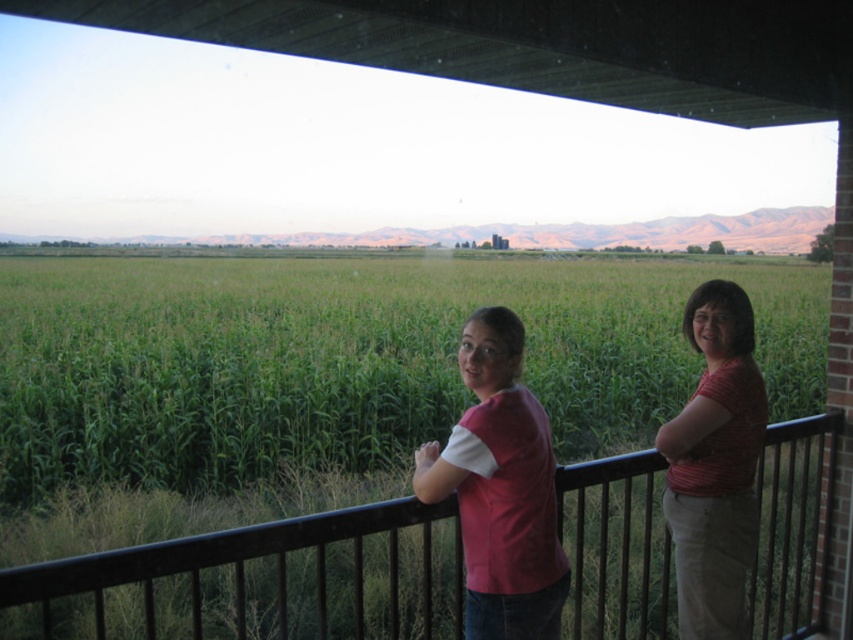
Question: Does green grassy corn field at center have a larger size compared to matte pink shirt at right?

Choices:
 (A) no
 (B) yes

Answer: (B)

Question: Which object appears closest to the camera in this image?

Choices:
 (A) pink cotton shirt at center
 (B) black metal railing at lower center
 (C) matte pink shirt at right
 (D) green grassy corn field at center

Answer: (A)

Question: Which point is closer to the camera?

Choices:
 (A) (587, 349)
 (B) (780, 552)

Answer: (B)

Question: Does pink cotton shirt at center come behind matte pink shirt at right?

Choices:
 (A) yes
 (B) no

Answer: (B)

Question: In this image, where is pink cotton shirt at center located relative to matte pink shirt at right?

Choices:
 (A) left
 (B) right

Answer: (A)

Question: Which of the following is the farthest from the observer?

Choices:
 (A) (637, 604)
 (B) (694, 292)
 (C) (200, 369)
 (D) (490, 509)

Answer: (C)